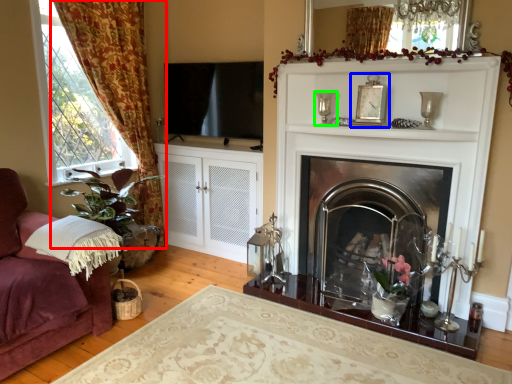
Question: Which object is the closest to the curtain (highlighted by a red box)? Choose among these: picture frame (highlighted by a blue box) or candle holder (highlighted by a green box).

Choices:
 (A) picture frame
 (B) candle holder

Answer: (B)